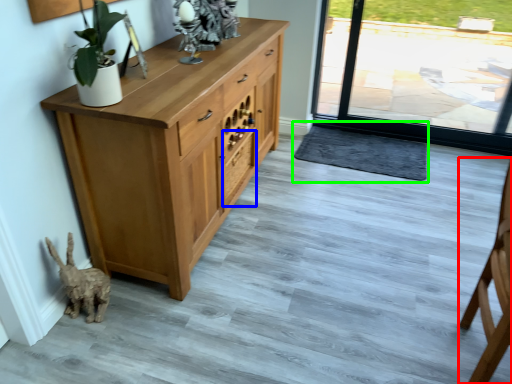
Question: Which object is positioned closest to chair (highlighted by a red box)? Select from drawer (highlighted by a blue box) and doormat (highlighted by a green box).

Choices:
 (A) drawer
 (B) doormat

Answer: (B)